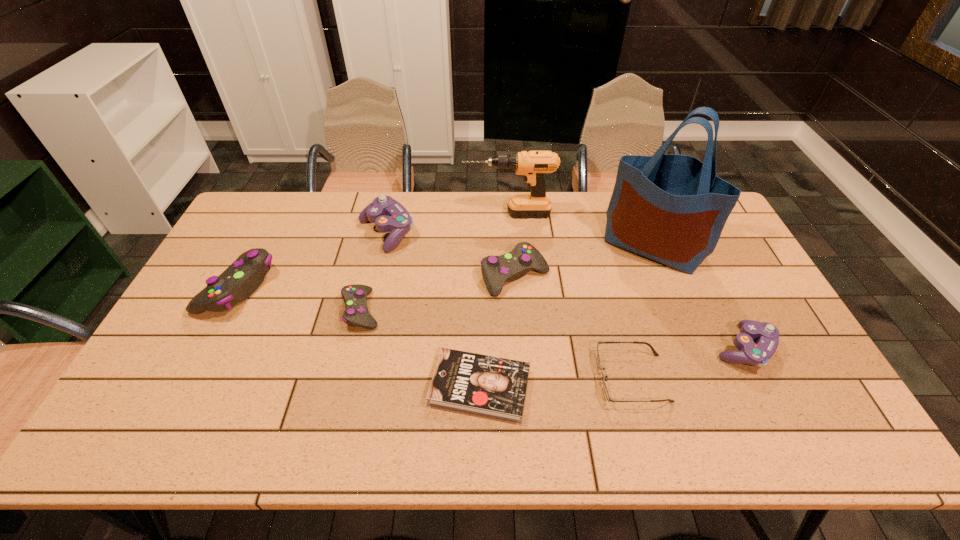
You are a GUI agent. You are given a task and a screenshot of the screen. Output one action in this format:
    pyautogui.click(x=<x>, y=<y>)
    Task: Click on the handbag
    The height and width of the screenshot is (540, 960).
    Given the screenshot: What is the action you would take?
    pyautogui.click(x=670, y=208)

At what (x,y) coordinates should I click in order to perform the action: click on the tallest object. Please return your answer as a coordinate pair (x, y). The image size is (960, 540). Looking at the image, I should click on (670, 208).

Identify the location of drill. (532, 165).

This screenshot has width=960, height=540. Find the location of `the farthest control`. the farthest control is located at coordinates (389, 215).

This screenshot has width=960, height=540. Find the location of `the left purple control`. the left purple control is located at coordinates (389, 215).

You are a GUI agent. You are given a task and a screenshot of the screen. Output one action in this format:
    pyautogui.click(x=<x>, y=<y>)
    Task: Click on the biggest gray control
    This screenshot has width=960, height=540.
    Given the screenshot: What is the action you would take?
    pyautogui.click(x=241, y=279)

Where is `the leftmost gray control`? This screenshot has width=960, height=540. the leftmost gray control is located at coordinates (241, 279).

Locate an element on the screen. The width and height of the screenshot is (960, 540). the fourth control from left to right is located at coordinates (496, 270).

In order to click on the rightmost gray control in this screenshot , I will do `click(496, 270)`.

The width and height of the screenshot is (960, 540). I want to click on the smaller purple control, so click(x=756, y=354).